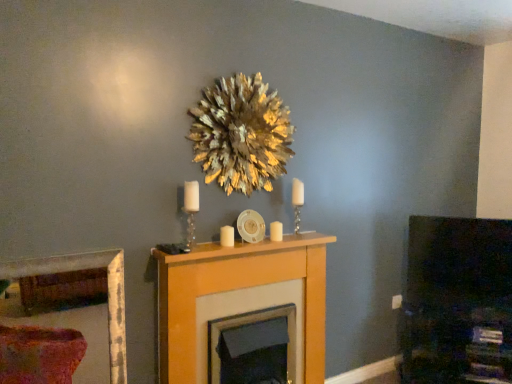
Identify the location of free space to the left of white matte candle at center, the first candle in the left-to-right sequence. Image resolution: width=512 pixels, height=384 pixels. (199, 251).